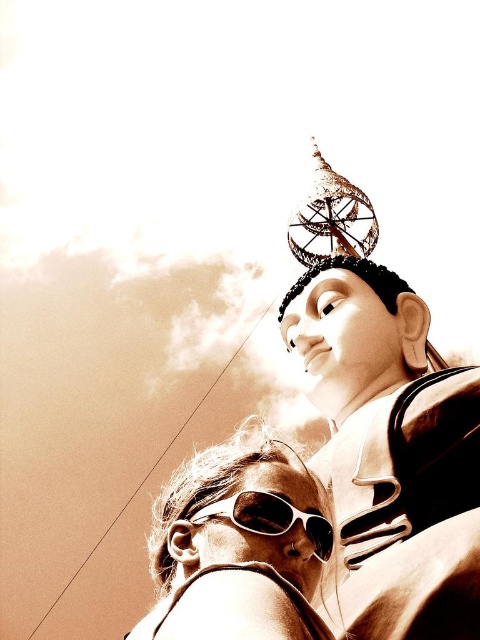
Question: Which of the following is the farthest from the observer?

Choices:
 (A) (305, 518)
 (B) (435, 436)

Answer: (B)

Question: Can you confirm if sepia-toned statue at center is positioned to the left of sunglasses at lower center?

Choices:
 (A) no
 (B) yes

Answer: (A)

Question: Considering the relative positions of sepia-toned statue at center and sunglasses at lower center in the image provided, where is sepia-toned statue at center located with respect to sunglasses at lower center?

Choices:
 (A) below
 (B) above

Answer: (B)

Question: Does sepia-toned statue at center have a lesser width compared to sunglasses at lower center?

Choices:
 (A) yes
 (B) no

Answer: (A)

Question: Which of these objects is positioned closest to the white matte goggles at center?

Choices:
 (A) sepia-toned statue at center
 (B) sunglasses at lower center

Answer: (B)

Question: Which object is closer to the camera taking this photo?

Choices:
 (A) sepia-toned statue at center
 (B) white matte goggles at center

Answer: (A)